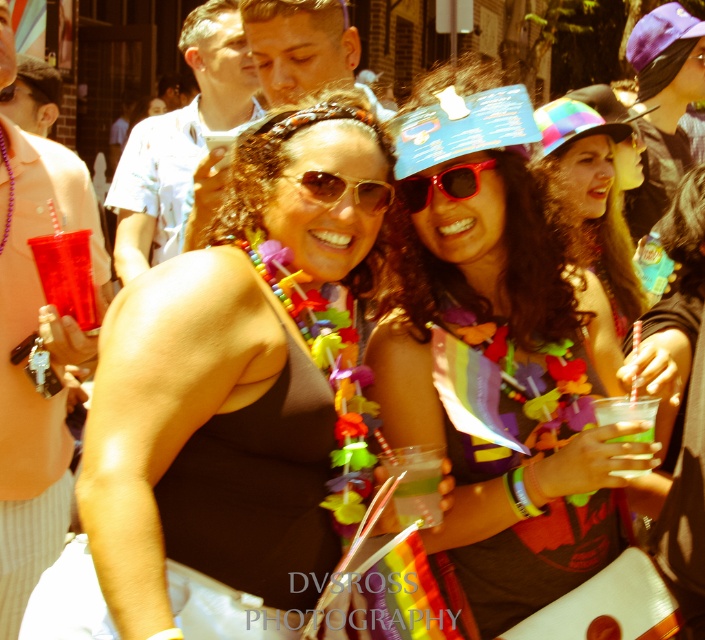
You are at a festive outdoor event and see the red plastic sunglasses at center and the clear plastic cup at lower right. Which object is taller?

The clear plastic cup at lower right is taller than the red plastic sunglasses at center.